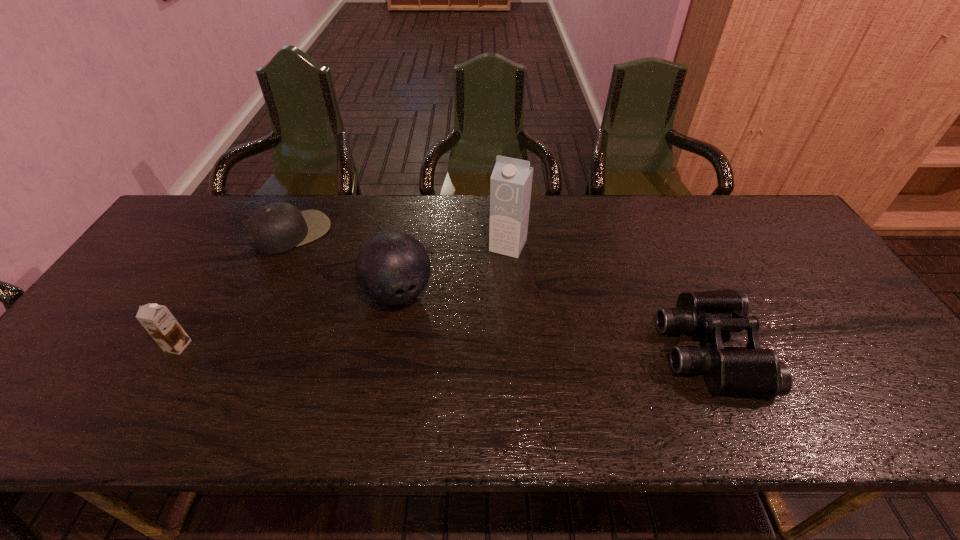
Find the location of a particular element. This screenshot has height=540, width=960. chocolate milk is located at coordinates (158, 321).

Image resolution: width=960 pixels, height=540 pixels. Find the location of `the leftmost object`. the leftmost object is located at coordinates (158, 321).

Where is `binoculars`? binoculars is located at coordinates (753, 371).

At what (x,y) coordinates should I click in order to perform the action: click on the third object from right to left. Please return your answer as a coordinate pair (x, y). Image resolution: width=960 pixels, height=540 pixels. Looking at the image, I should click on (392, 268).

The height and width of the screenshot is (540, 960). I want to click on the second tallest object, so click(392, 268).

Locate an element on the screen. The width and height of the screenshot is (960, 540). cap is located at coordinates (275, 228).

Locate an element on the screen. carton is located at coordinates (511, 181).

The height and width of the screenshot is (540, 960). Find the location of `the tallest object`. the tallest object is located at coordinates (511, 181).

Where is `free location located 0.180m on the left of the third shortest object`? This screenshot has width=960, height=540. free location located 0.180m on the left of the third shortest object is located at coordinates (93, 346).

You are a GUI agent. You are given a task and a screenshot of the screen. Output one action in this format:
    pyautogui.click(x=<x>, y=<y>)
    Task: Click on the vacant space located on the front-facing side of the binoculars
    Image resolution: width=960 pixels, height=540 pixels.
    Given the screenshot: What is the action you would take?
    pyautogui.click(x=807, y=349)